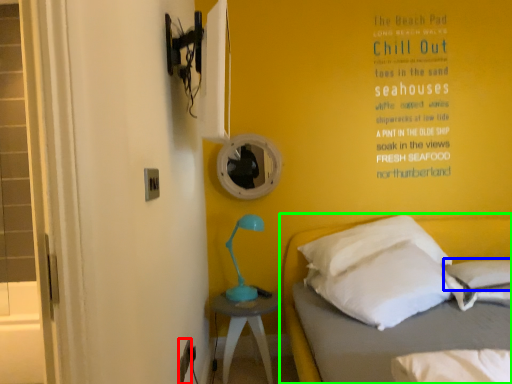
Question: Which object is the closest to the electric outlet (highlighted by a red box)? Choose among these: pillow (highlighted by a blue box) or bed (highlighted by a green box).

Choices:
 (A) pillow
 (B) bed

Answer: (B)